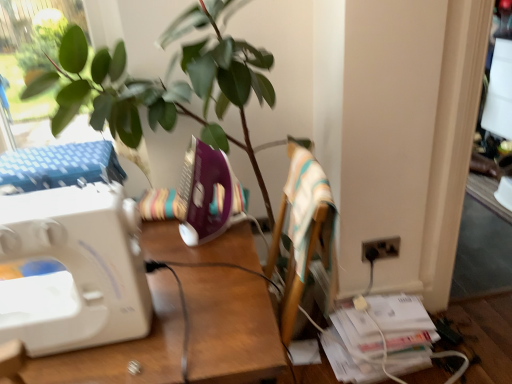
You are a GUI agent. You are given a task and a screenshot of the screen. Output one action in this format:
    pyautogui.click(x=<x>, y=<y>)
    Task: Click on the vacant area located to the right-hand side of white plastic sewing machine at left, the first sewing machine viewed from the left
    This screenshot has height=384, width=512.
    Given the screenshot: What is the action you would take?
    pyautogui.click(x=191, y=308)